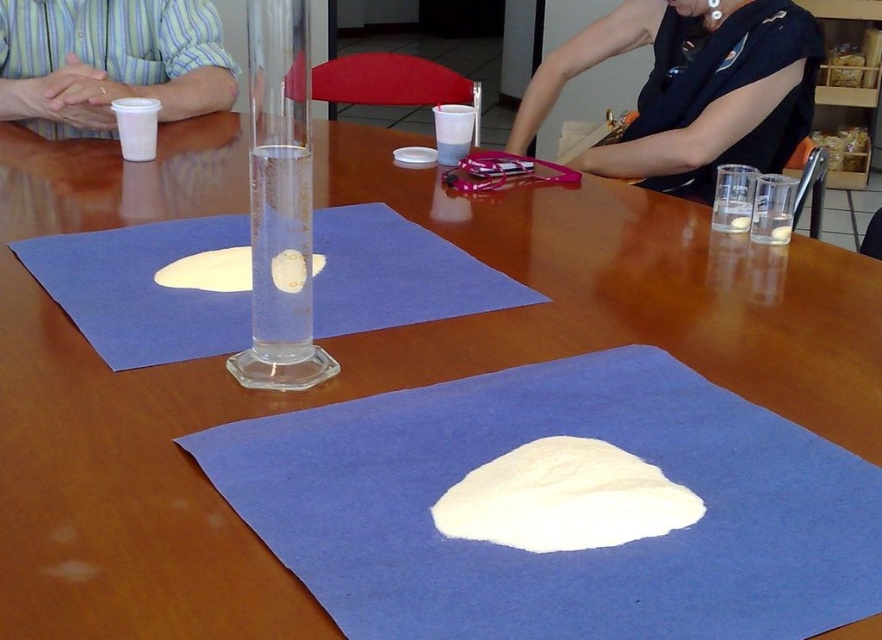
Question: Does striped cotton shirt at left have a greater width compared to white fluffy dough at center?

Choices:
 (A) no
 (B) yes

Answer: (B)

Question: Is white felt cloth at center below white matte dough at center?

Choices:
 (A) no
 (B) yes

Answer: (B)

Question: Which point is closer to the camera taking this photo?

Choices:
 (A) (383, 225)
 (B) (163, 280)

Answer: (B)

Question: Which point is closer to the camera taking this photo?

Choices:
 (A) (484, 310)
 (B) (372, 620)

Answer: (B)

Question: Which point is farther to the camera?

Choices:
 (A) (244, 268)
 (B) (505, 492)
 (C) (737, 134)

Answer: (C)

Question: Is black fabric at upper right below striped cotton shirt at left?

Choices:
 (A) no
 (B) yes

Answer: (A)